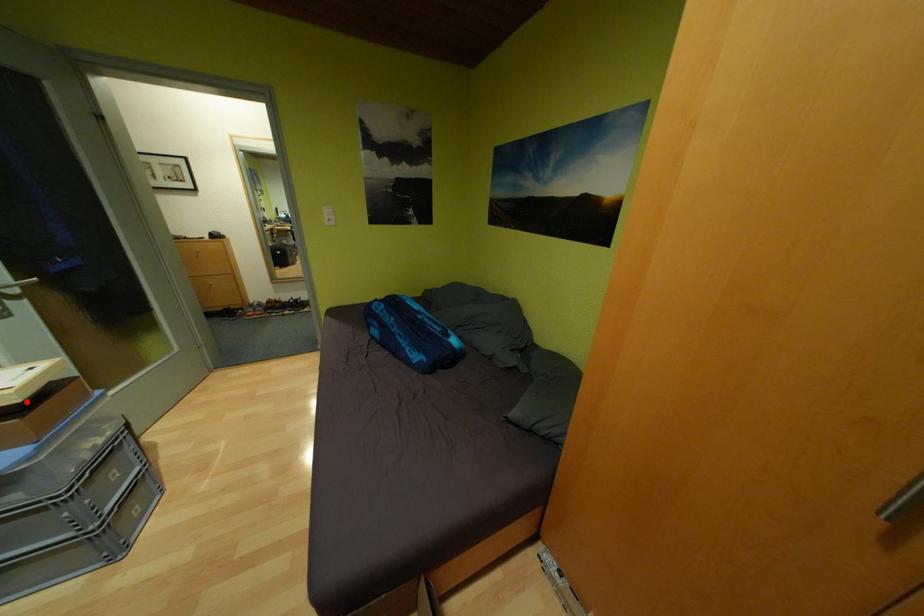
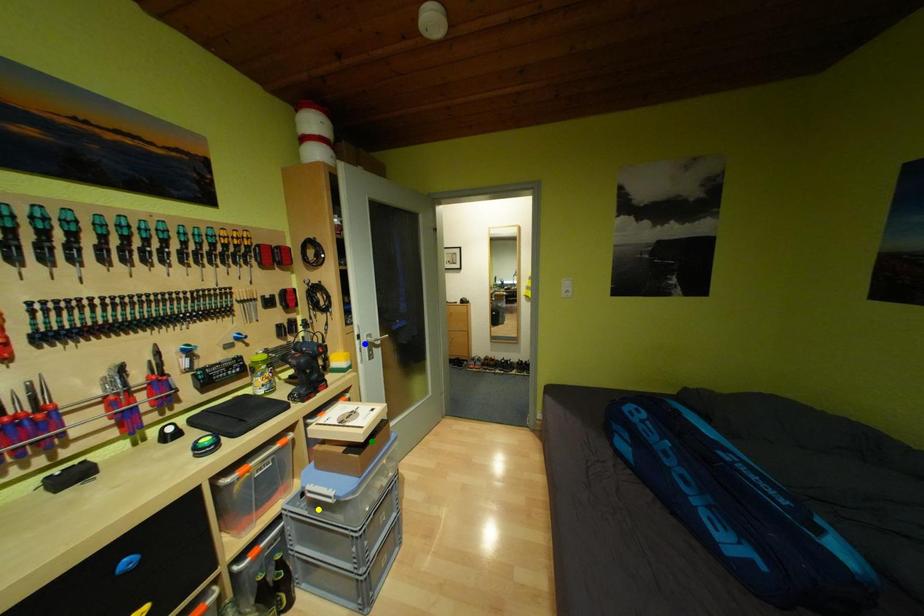
Question: I am providing you with two images of the same scene from different viewpoints. A red point is marked on the first image. You are given multiple points on the second image. Can you choose the point in image 2 that corresponds to the point in image 1?

Choices:
 (A) blue point
 (B) green point
 (C) yellow point

Answer: (B)